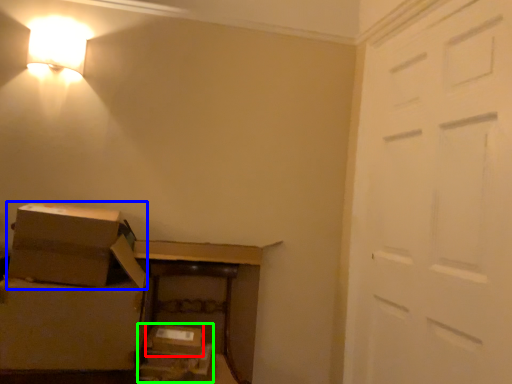
Question: Which object is positioned farthest from storage box (highlighted by a red box)? Select from box (highlighted by a blue box) and storage box (highlighted by a green box).

Choices:
 (A) box
 (B) storage box

Answer: (A)